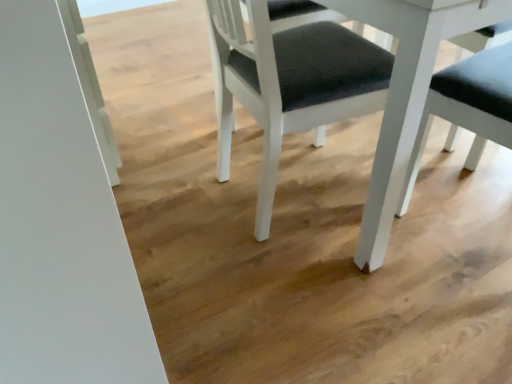
Question: Considering the relative positions of white matte chair at center and white matte table at center in the image provided, is white matte chair at center to the right of white matte table at center from the viewer's perspective?

Choices:
 (A) no
 (B) yes

Answer: (A)

Question: Is white matte chair at center far from white matte table at center?

Choices:
 (A) no
 (B) yes

Answer: (A)

Question: From the image's perspective, is white matte chair at center located above white matte table at center?

Choices:
 (A) yes
 (B) no

Answer: (B)

Question: Considering the relative sizes of white matte chair at center and white matte table at center in the image provided, is white matte chair at center shorter than white matte table at center?

Choices:
 (A) yes
 (B) no

Answer: (A)

Question: From a real-world perspective, is white matte chair at center on white matte table at center?

Choices:
 (A) no
 (B) yes

Answer: (A)

Question: Considering the relative sizes of white matte chair at center and white matte table at center in the image provided, is white matte chair at center thinner than white matte table at center?

Choices:
 (A) no
 (B) yes

Answer: (B)

Question: Is white matte table at center positioned with its back to white matte chair at center?

Choices:
 (A) no
 (B) yes

Answer: (B)

Question: Could white matte chair at center be considered to be inside white matte table at center?

Choices:
 (A) no
 (B) yes

Answer: (B)

Question: Does white matte table at center have a lesser width compared to white matte chair at center?

Choices:
 (A) no
 (B) yes

Answer: (A)

Question: Does white matte table at center appear on the right side of white matte chair at center?

Choices:
 (A) yes
 (B) no

Answer: (A)

Question: Is white matte table at center outside of white matte chair at center?

Choices:
 (A) no
 (B) yes

Answer: (B)

Question: From a real-world perspective, is white matte table at center positioned over white matte chair at center based on gravity?

Choices:
 (A) yes
 (B) no

Answer: (A)

Question: Looking at their shapes, would you say white matte table at center is wider or thinner than white matte chair at center?

Choices:
 (A) wide
 (B) thin

Answer: (A)